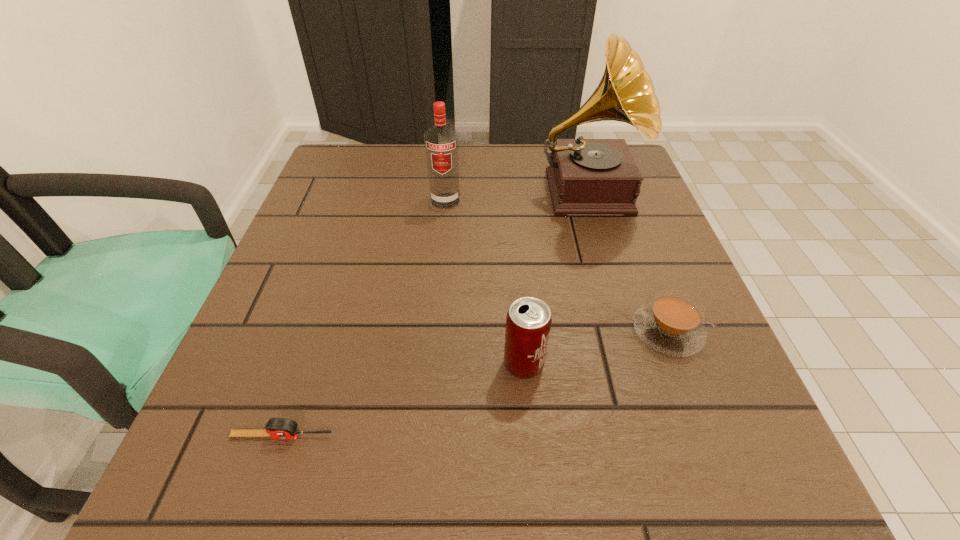
Image resolution: width=960 pixels, height=540 pixels. In the image, there is a desktop. What are the coordinates of `free region at the left edge` in the screenshot? It's located at (338, 253).

Identify the location of vacant space at the right edge of the desktop. (631, 244).

I want to click on empty space between the phonograph record and the cappuccino, so click(627, 261).

Find the location of `free spot between the cappuccino and the vodka`. free spot between the cappuccino and the vodka is located at coordinates (557, 266).

Locate an element on the screen. Image resolution: width=960 pixels, height=540 pixels. free spot between the fourth tallest object and the phonograph record is located at coordinates (627, 261).

At what (x,y) coordinates should I click in order to perform the action: click on free space between the shortest object and the cappuccino. Please return your answer as a coordinate pair (x, y). This screenshot has width=960, height=540. Looking at the image, I should click on pos(475,383).

At what (x,y) coordinates should I click in order to perform the action: click on vacant region between the fourth tallest object and the tape measure. Please return your answer as a coordinate pair (x, y). This screenshot has height=540, width=960. Looking at the image, I should click on (475, 383).

Locate an element on the screen. This screenshot has width=960, height=540. free space between the cappuccino and the shortest object is located at coordinates (475, 383).

Where is `vacant space that is in between the third object from right to left and the second shortest object`? vacant space that is in between the third object from right to left and the second shortest object is located at coordinates (596, 348).

Where is `empty location between the phonograph record and the third shortest object`? Image resolution: width=960 pixels, height=540 pixels. empty location between the phonograph record and the third shortest object is located at coordinates (555, 278).